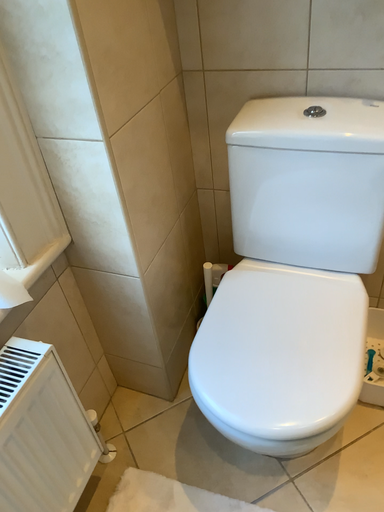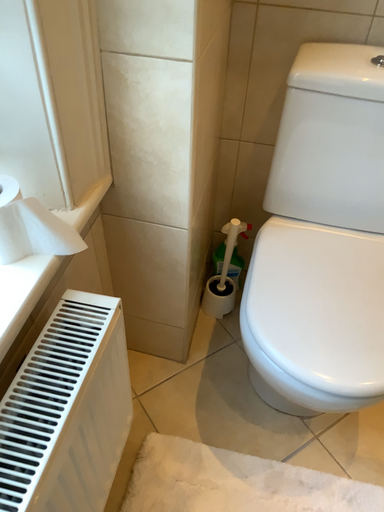
Question: How did the camera likely rotate when shooting the video?

Choices:
 (A) rotated left
 (B) rotated right

Answer: (B)